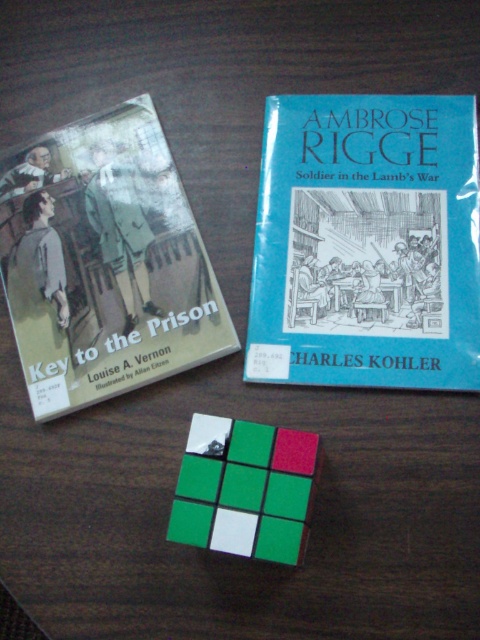
I want to click on blue paperback book at upper right, so click(367, 243).

Who is more forward, (x=395, y=173) or (x=85, y=316)?

Point (x=85, y=316) is more forward.

Locate an element on the screen. The width and height of the screenshot is (480, 640). blue paperback book at upper right is located at coordinates (367, 243).

Between matte paper book at left and green matte rubik's cube at center, which one is positioned lower?

green matte rubik's cube at center is lower down.

You are a GUI agent. You are given a task and a screenshot of the screen. Output one action in this format:
    pyautogui.click(x=<x>, y=<y>)
    Task: Click on the matte paper book at left
    
    Given the screenshot: What is the action you would take?
    pyautogui.click(x=104, y=262)

Between point (115, 289) and point (266, 451), which one is positioned in front?

Point (266, 451)

Where is `matte paper book at left`? This screenshot has width=480, height=640. matte paper book at left is located at coordinates (104, 262).

Is blue paperback book at upper right to the right of green matte rubik's cube at center from the viewer's perspective?

Correct, you'll find blue paperback book at upper right to the right of green matte rubik's cube at center.

Measure the distance between blue paperback book at upper right and green matte rubik's cube at center.

blue paperback book at upper right is 11.27 inches away from green matte rubik's cube at center.

Is point (359, 225) in front of point (264, 492)?

No, it is not.

Image resolution: width=480 pixels, height=640 pixels. I want to click on blue paperback book at upper right, so click(x=367, y=243).